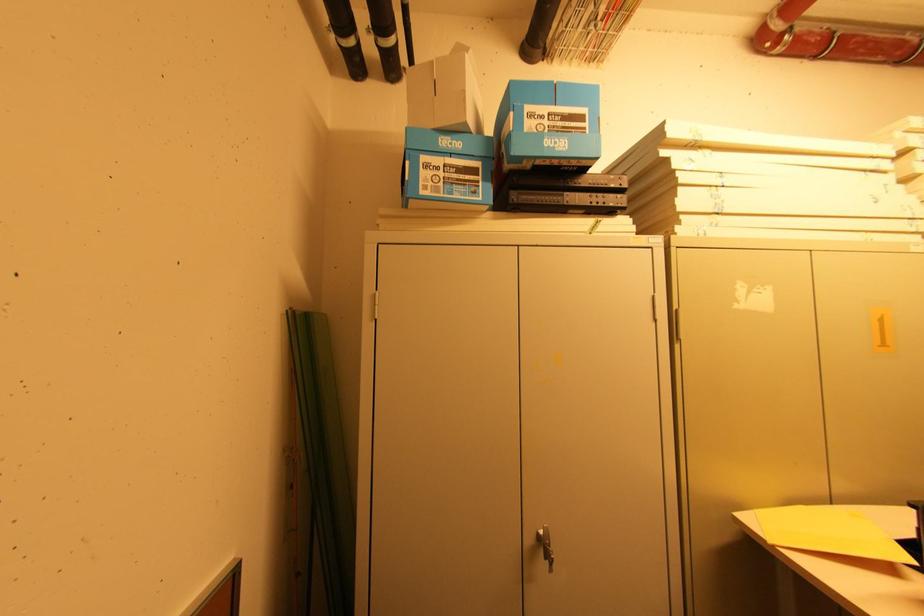
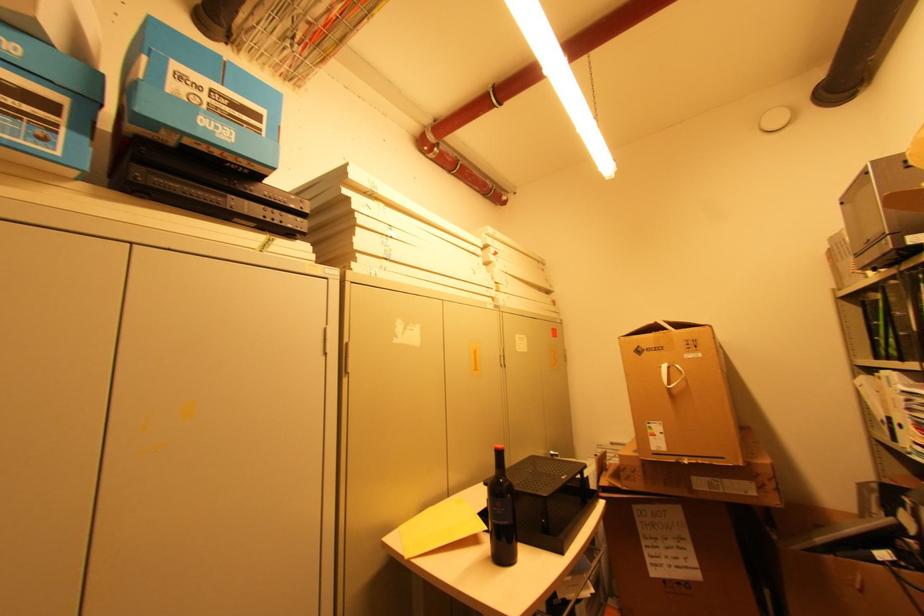
Question: How did the camera likely rotate?

Choices:
 (A) Left
 (B) Right
 (C) Up
 (D) Down

Answer: (B)